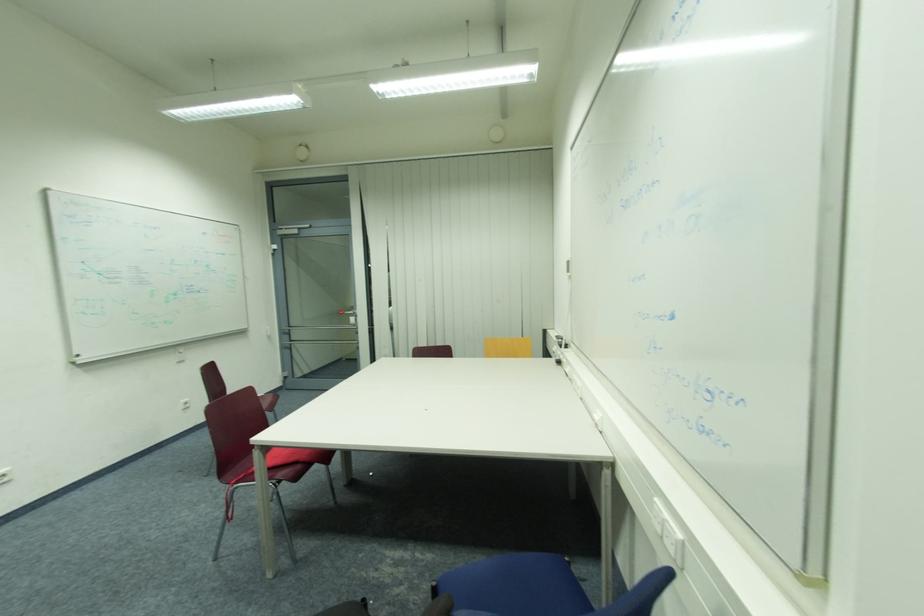
Find where to sit the red chair sitting surface. Please return your answer as a coordinate pair (x, y).

(276, 456)